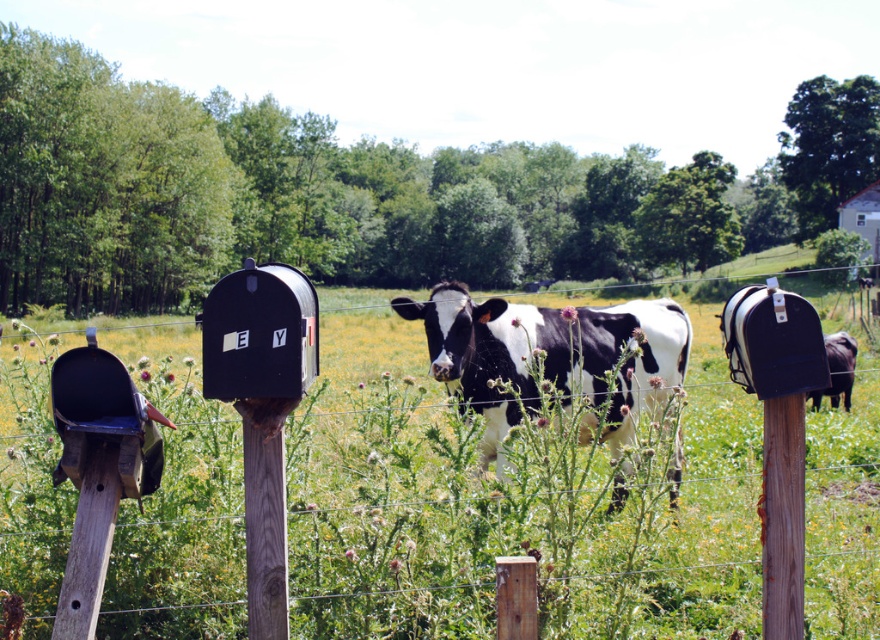
You are a delivery person trying to place a package between the wooden post at center and the weathered wood post at center. The package is 1.6 meters long. Will it fit between them?

The wooden post at center and weathered wood post at center are 1.55 meters apart. Since the package is 1.6 meters long, it will not fit between them as the distance is shorter than the package length.